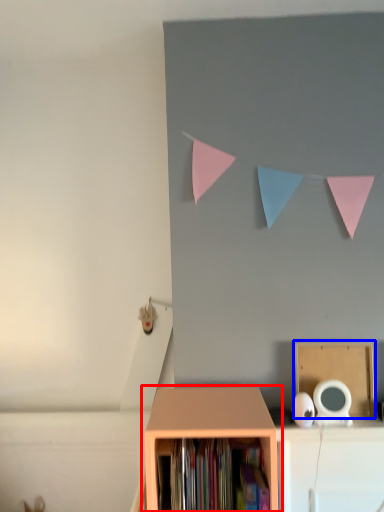
Question: Which object appears farthest to the camera in this image, shelf (highlighted by a red box) or cardboard box (highlighted by a blue box)?

Choices:
 (A) shelf
 (B) cardboard box

Answer: (B)